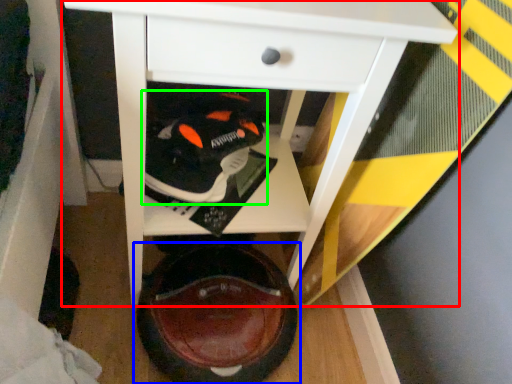
Question: Which is nearer to the table (highlighted by a red box)? footwear (highlighted by a blue box) or footwear (highlighted by a green box).

Choices:
 (A) footwear
 (B) footwear

Answer: (B)